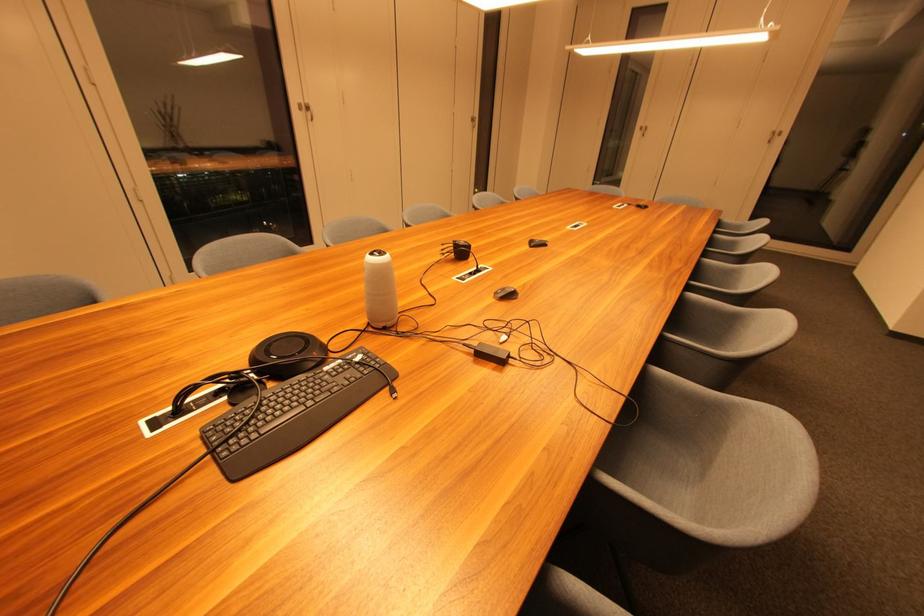
You are a GUI agent. You are given a task and a screenshot of the screen. Output one action in this format:
    pyautogui.click(x=<x>, y=<y>)
    Task: Click on the chair sitting surface
    This screenshot has width=924, height=616.
    Given the screenshot: What is the action you would take?
    pyautogui.click(x=664, y=460)